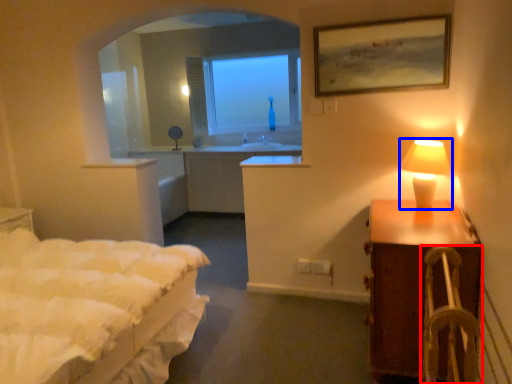
Question: Which object appears farthest to the camera in this image, armchair (highlighted by a red box) or table lamp (highlighted by a blue box)?

Choices:
 (A) armchair
 (B) table lamp

Answer: (B)